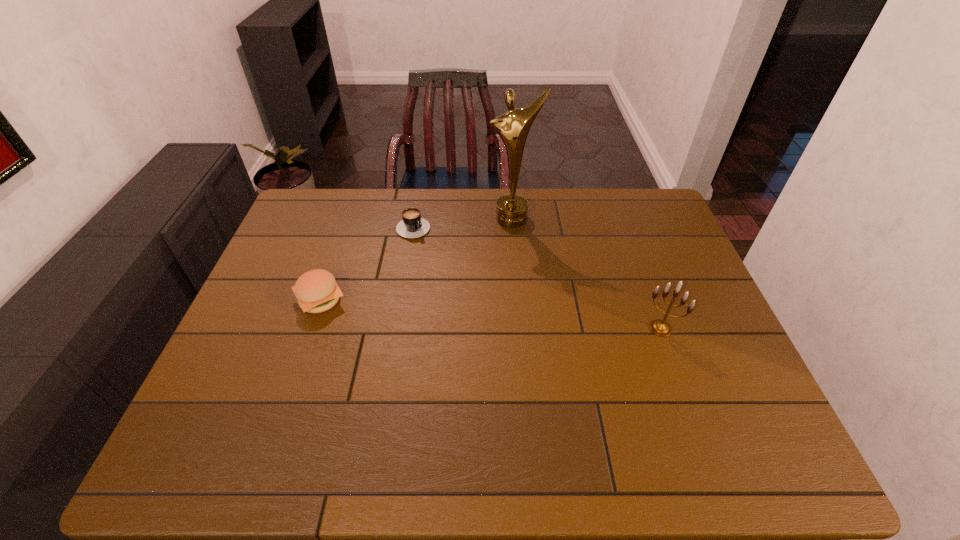
Where is `free space located 0.250m with the handle on the side of the shortest object`? The image size is (960, 540). free space located 0.250m with the handle on the side of the shortest object is located at coordinates (470, 279).

This screenshot has height=540, width=960. What are the coordinates of `vacant space situated 0.330m with the handle on the side of the shortest object` in the screenshot? It's located at (488, 295).

What are the coordinates of `vacant space situated with the handle on the side of the shortest object` in the screenshot? It's located at [x=467, y=275].

Identify the location of free location located on the front-facing side of the third object from left to right. This screenshot has width=960, height=540. (514, 257).

I want to click on vacant position located 0.150m on the front-facing side of the third object from left to right, so click(514, 259).

Where is `free space located 0.250m on the front-facing side of the third object from left to right`? The width and height of the screenshot is (960, 540). free space located 0.250m on the front-facing side of the third object from left to right is located at coordinates (515, 282).

Where is `cappuccino that is at the far edge`? Image resolution: width=960 pixels, height=540 pixels. cappuccino that is at the far edge is located at coordinates (412, 226).

I want to click on award located at the far edge, so 513,127.

Where is `object located in the left edge section of the desktop`? The width and height of the screenshot is (960, 540). object located in the left edge section of the desktop is located at coordinates (316, 290).

What are the coordinates of `object situated at the right edge` in the screenshot? It's located at (661, 328).